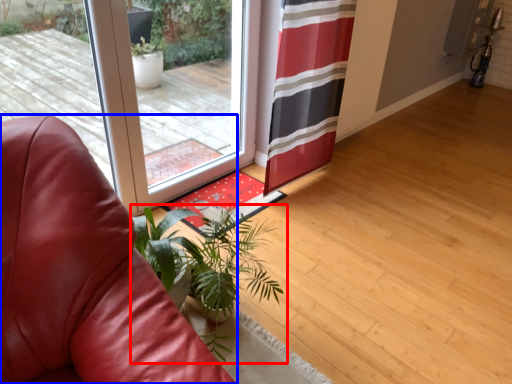
Question: Among these objects, which one is nearest to the camera, houseplant (highlighted by a red box) or chair (highlighted by a blue box)?

Choices:
 (A) houseplant
 (B) chair

Answer: (B)